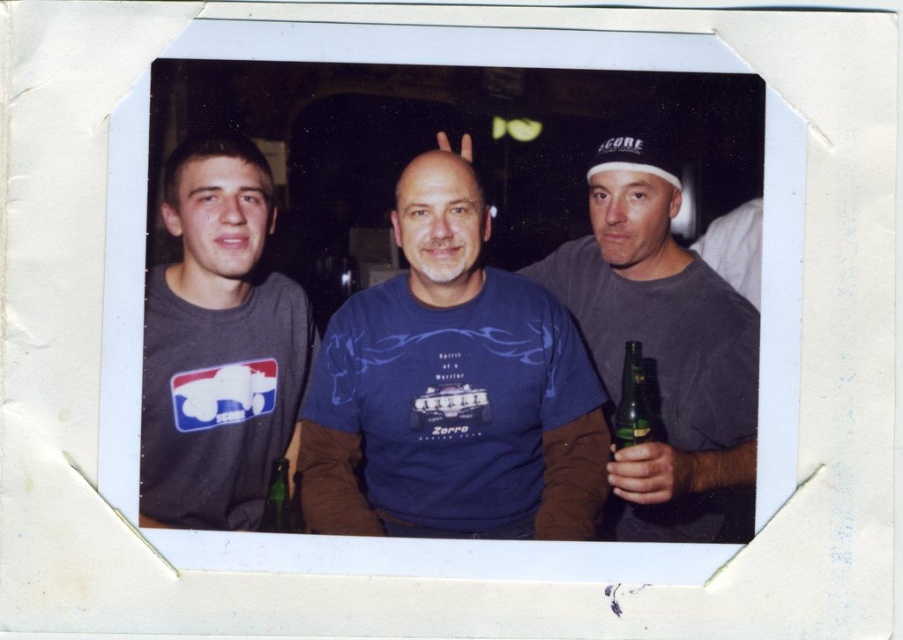
Question: Does matte gray t-shirt at left have a smaller size compared to white matte baseball cap at center right?

Choices:
 (A) yes
 (B) no

Answer: (B)

Question: Based on their relative distances, which object is farther from the gray matte shirt at right?

Choices:
 (A) white matte baseball cap at center right
 (B) matte gray t-shirt at left
 (C) green glass bottle at center
 (D) blue cotton t-shirt at center

Answer: (C)

Question: Can you confirm if gray matte shirt at right is positioned above white matte baseball cap at center right?

Choices:
 (A) no
 (B) yes

Answer: (A)

Question: Which of these objects is positioned closest to the green glass bottle at right?

Choices:
 (A) matte gray t-shirt at left
 (B) gray matte shirt at right
 (C) white matte baseball cap at center right
 (D) green glass bottle at center

Answer: (B)

Question: Which object is positioned closest to the blue cotton t-shirt at center?

Choices:
 (A) matte gray t-shirt at left
 (B) green glass bottle at right
 (C) green glass bottle at center
 (D) gray matte shirt at right

Answer: (D)

Question: Can you confirm if white matte baseball cap at center right is wider than green glass bottle at right?

Choices:
 (A) no
 (B) yes

Answer: (B)